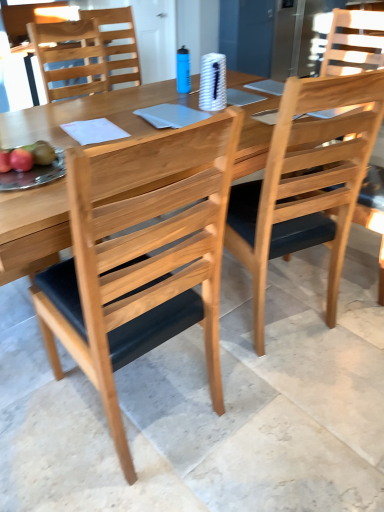
The image size is (384, 512). I want to click on free location in front of shiny red apple at left, which appears as the 2th fruit when viewed from the back, so (23, 187).